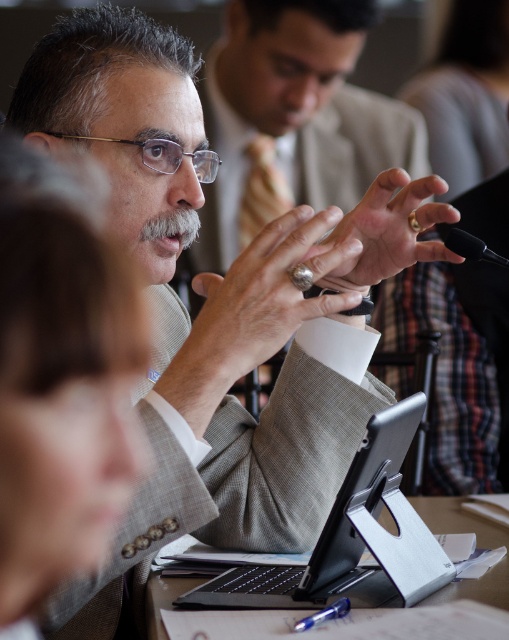
Question: Is black matte laptop at center smaller than black matte microphone at center?

Choices:
 (A) no
 (B) yes

Answer: (A)

Question: Does black matte laptop at center have a larger size compared to black plastic tablet at center?

Choices:
 (A) yes
 (B) no

Answer: (A)

Question: Among these points, which one is nearest to the camera?

Choices:
 (A) (488, 260)
 (B) (499, 605)
 (C) (295, 566)

Answer: (B)

Question: Among these points, which one is farthest from the camera?

Choices:
 (A) (291, 588)
 (B) (450, 225)
 (C) (173, 596)

Answer: (B)

Question: Does black matte laptop at center have a smaller size compared to black plastic tablet at center?

Choices:
 (A) yes
 (B) no

Answer: (B)

Question: Which of the following is the closest to the observer?

Choices:
 (A) black plastic tablet at center
 (B) black matte microphone at center
 (C) black matte laptop at center

Answer: (C)